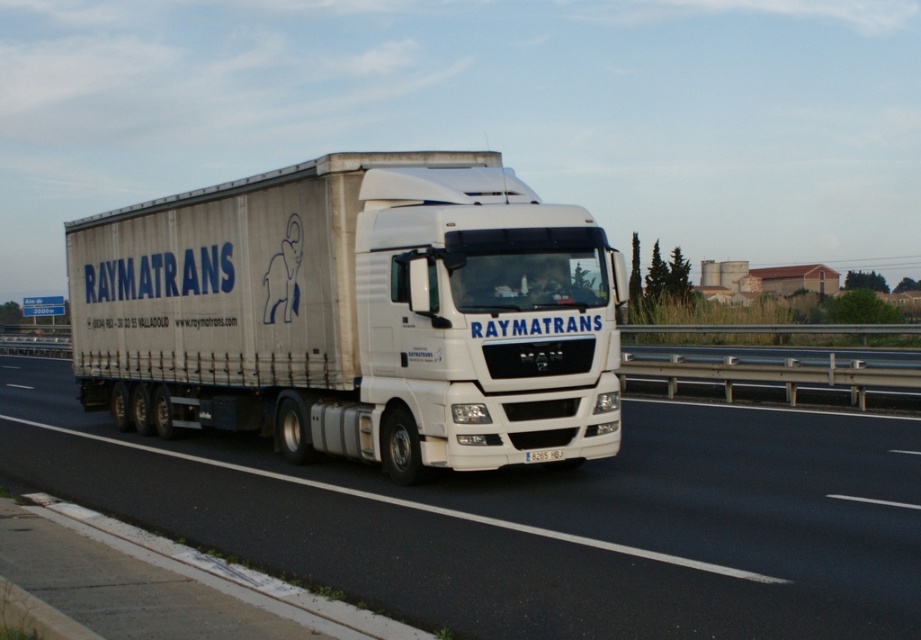
Question: Can you confirm if white glossy truck at center is thinner than white matte truck at center?

Choices:
 (A) no
 (B) yes

Answer: (A)

Question: Among these points, which one is nearest to the camera?

Choices:
 (A) (287, 541)
 (B) (278, 241)

Answer: (A)

Question: Which object is closer to the camera taking this photo?

Choices:
 (A) white matte truck at center
 (B) white glossy truck at center

Answer: (B)

Question: Does white glossy truck at center come behind white matte truck at center?

Choices:
 (A) no
 (B) yes

Answer: (A)

Question: Where is white glossy truck at center located in relation to white matte truck at center in the image?

Choices:
 (A) above
 (B) below

Answer: (B)